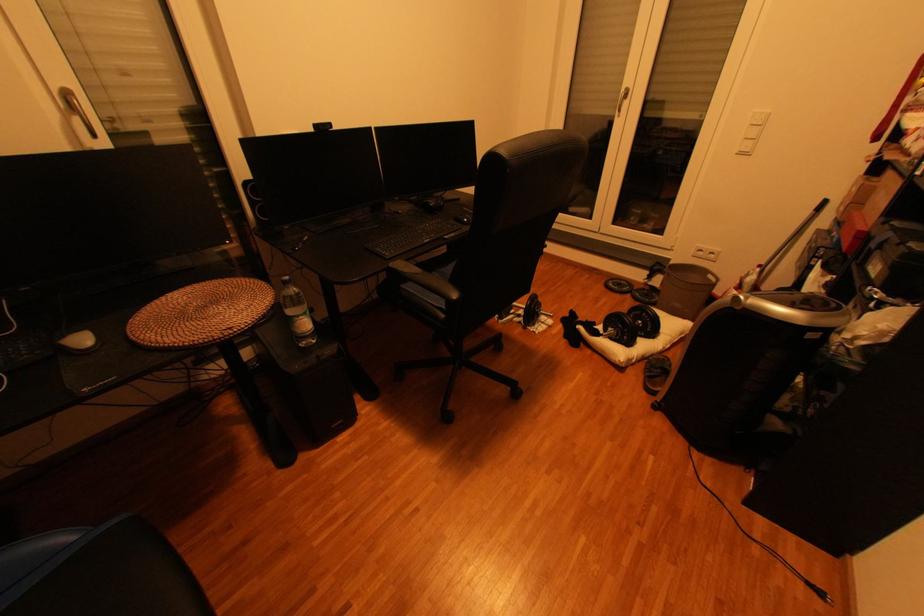
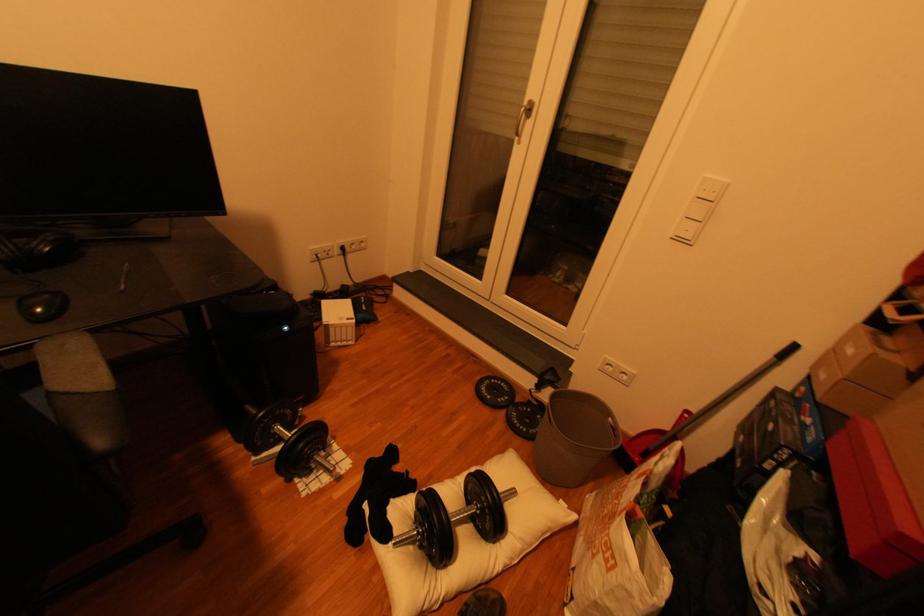
Which direction would the cameraman need to move to produce the second image?

The cameraman walked toward right, forward.